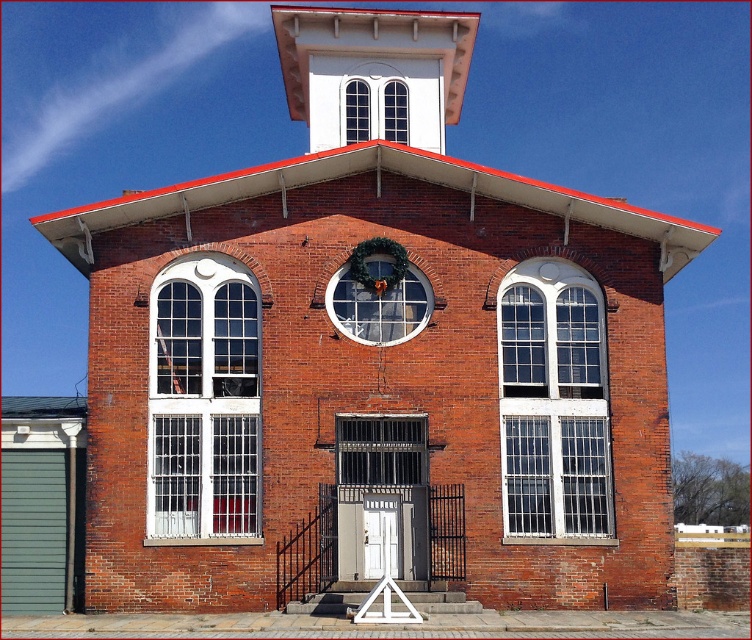
Can you confirm if white glass window at left is positioned below clear glass window at upper center?

Indeed, white glass window at left is positioned under clear glass window at upper center.

Describe the element at coordinates (202, 401) in the screenshot. I see `white glass window at left` at that location.

Which is in front, point (174, 490) or point (376, 113)?

Point (174, 490) is in front.

Locate an element on the screen. white glass window at left is located at coordinates (202, 401).

Does white glass window at left have a greater width compared to green wreath at center?

Incorrect, white glass window at left's width does not surpass green wreath at center's.

Does white glass window at left appear under green wreath at center?

Correct, white glass window at left is located below green wreath at center.

You are a GUI agent. You are given a task and a screenshot of the screen. Output one action in this format:
    pyautogui.click(x=<x>, y=<y>)
    Task: Click on the white glass window at left
    This screenshot has height=640, width=752.
    Given the screenshot: What is the action you would take?
    pyautogui.click(x=202, y=401)

The image size is (752, 640). I want to click on white glass window at left, so click(202, 401).

Does point (566, 349) come in front of point (364, 310)?

No, (566, 349) is behind (364, 310).

Who is lower down, white textured glass window at right or green wreath at center?

white textured glass window at right

Describe the element at coordinates (553, 403) in the screenshot. I see `white textured glass window at right` at that location.

Identify the location of white textured glass window at right. Image resolution: width=752 pixels, height=640 pixels. (553, 403).